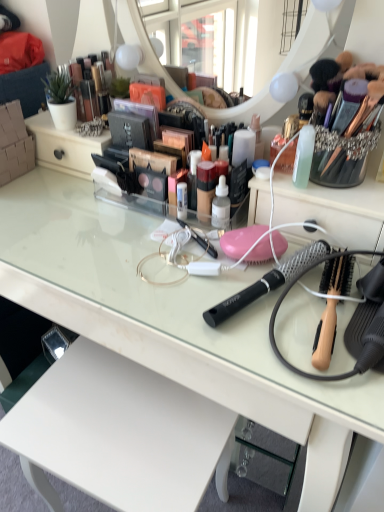
Where is `free space that is to the left of wooden-handled hairbrush at right, the 2th brush in the left-to-right sequence`? free space that is to the left of wooden-handled hairbrush at right, the 2th brush in the left-to-right sequence is located at coordinates (219, 303).